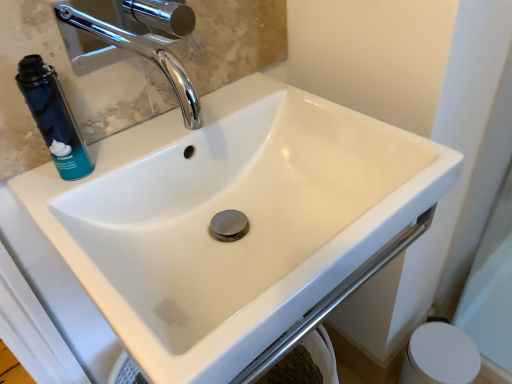
Locate an element on the screen. vacant location behind blue matte can at upper left is located at coordinates (136, 137).